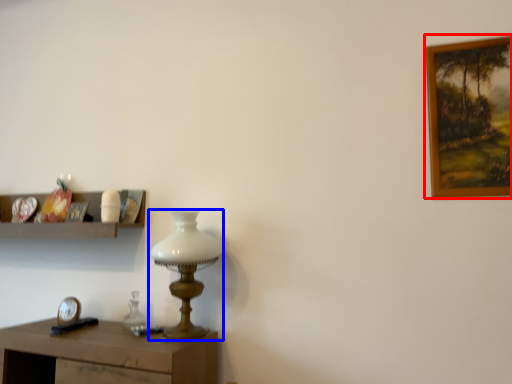
Question: Which point is further to the camera, picture frame (highlighted by a red box) or table lamp (highlighted by a blue box)?

Choices:
 (A) picture frame
 (B) table lamp

Answer: (B)